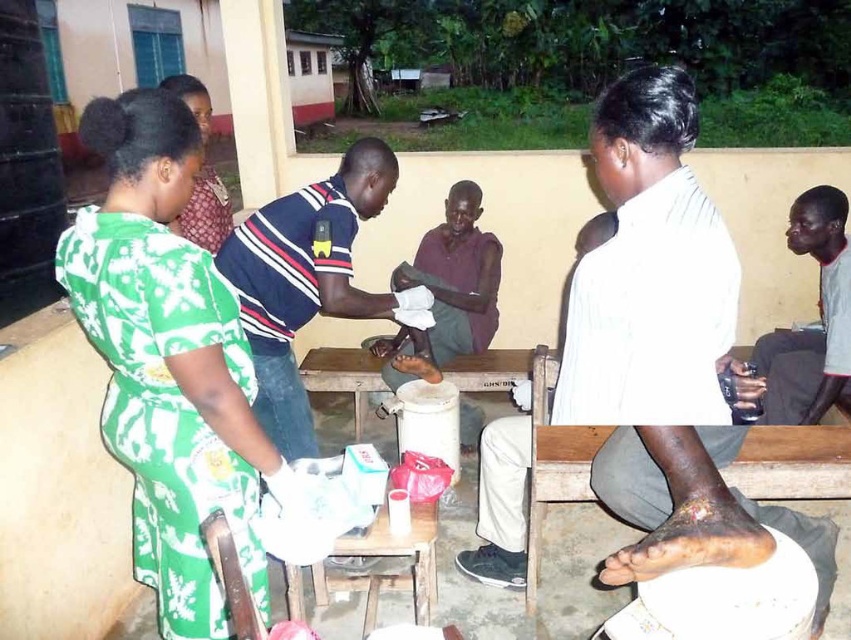
You are a GUI agent. You are given a task and a screenshot of the screen. Output one action in this format:
    pyautogui.click(x=<x>, y=<y>)
    Task: Click on the striped cotton shirt at center
    The width and height of the screenshot is (851, 640).
    Given the screenshot: What is the action you would take?
    pyautogui.click(x=307, y=280)

Can you confirm if striped cotton shirt at center is positioned below green floral dress at upper left?

Yes, striped cotton shirt at center is below green floral dress at upper left.

What do you see at coordinates (307, 280) in the screenshot?
I see `striped cotton shirt at center` at bounding box center [307, 280].

Locate an element on the screen. This screenshot has width=851, height=640. striped cotton shirt at center is located at coordinates (307, 280).

Who is positioned more to the right, striped cotton shirt at center or dark gray fabric shirt at right?

dark gray fabric shirt at right

Is striped cotton shirt at center shorter than dark gray fabric shirt at right?

In fact, striped cotton shirt at center may be taller than dark gray fabric shirt at right.

The height and width of the screenshot is (640, 851). What do you see at coordinates (307, 280) in the screenshot?
I see `striped cotton shirt at center` at bounding box center [307, 280].

The image size is (851, 640). Identify the location of striped cotton shirt at center. (307, 280).

From the picture: Which is more to the right, dark gray fabric shirt at right or green floral dress at upper left?

dark gray fabric shirt at right

From the picture: Who is more forward, (x=837, y=288) or (x=200, y=93)?

Point (x=200, y=93) is in front.

At what (x,y) coordinates should I click in order to perform the action: click on dark gray fabric shirt at right. Please return your answer as a coordinate pair (x, y). This screenshot has width=851, height=640. Looking at the image, I should click on (820, 317).